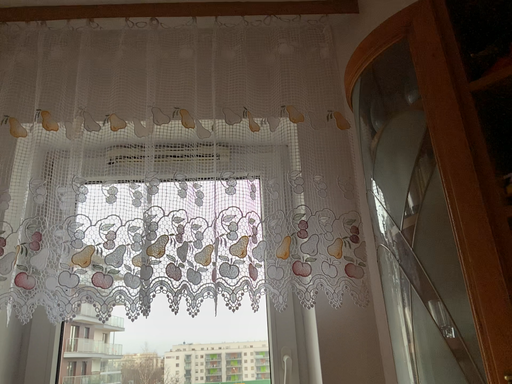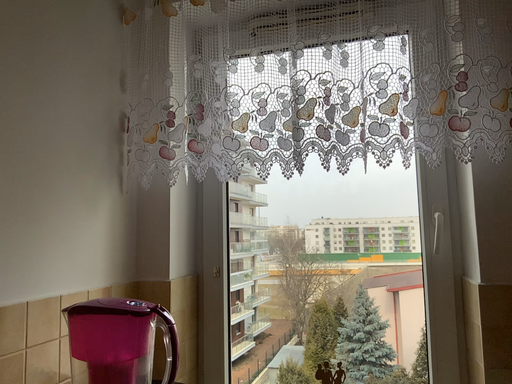
Question: Which way did the camera rotate in the video?

Choices:
 (A) rotated upward
 (B) rotated downward

Answer: (B)